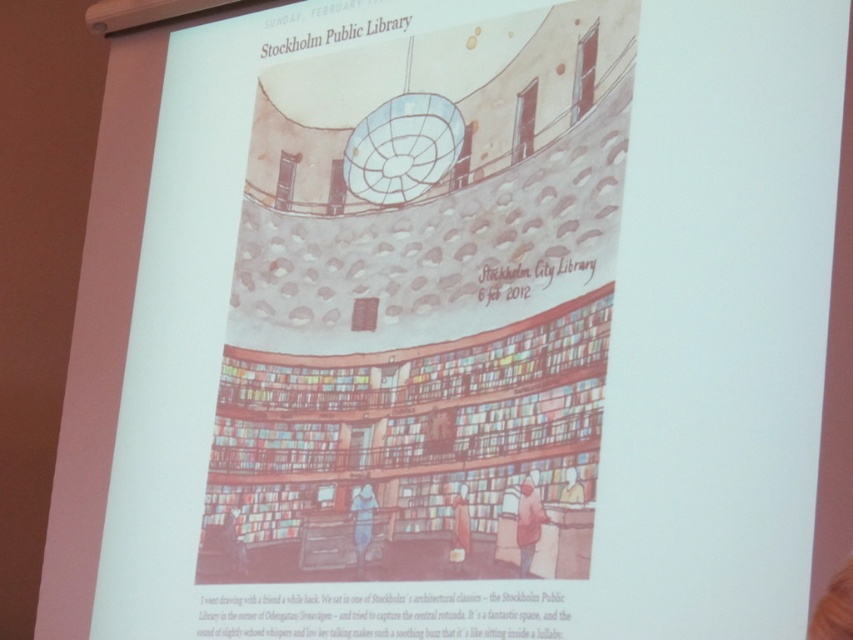
Question: Does multicolored wood bookshelf at center have a lesser width compared to light brown fabric jacket at lower center?

Choices:
 (A) no
 (B) yes

Answer: (A)

Question: Is multicolored wood bookshelf at center to the right of smooth beige coat at lower center from the viewer's perspective?

Choices:
 (A) no
 (B) yes

Answer: (A)

Question: Which point appears closest to the camera in this image?

Choices:
 (A) (224, 570)
 (B) (363, 488)
 (C) (468, 524)

Answer: (C)

Question: Which object is closer to the camera taking this photo?

Choices:
 (A) denim jacket at lower center
 (B) light brown fabric jacket at lower center
 (C) smooth beige coat at lower center

Answer: (B)

Question: Does denim jacket at lower center appear over light blue fabric at lower center?

Choices:
 (A) no
 (B) yes

Answer: (B)

Question: Which of the following is the closest to the observer?

Choices:
 (A) light brown fabric jacket at lower center
 (B) denim jacket at lower center
 (C) multicolored wood bookshelf at center
 (D) light blue fabric at lower center

Answer: (C)